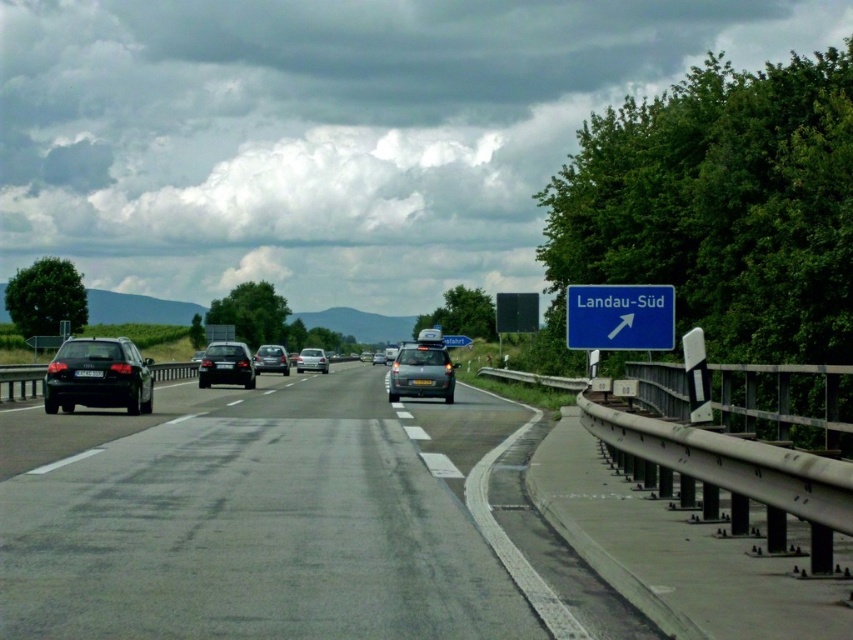
Looking at this image, who is more distant from viewer, (453, 364) or (270, 360)?

The point (453, 364) is more distant.

The image size is (853, 640). Find the location of `satin silver car at center`. satin silver car at center is located at coordinates (421, 372).

Can you confirm if shiny black sedan at left is wider than shiny metallic car at center?

In fact, shiny black sedan at left might be narrower than shiny metallic car at center.

Is point (45, 397) in front of point (277, 349)?

Yes, it is in front of point (277, 349).

This screenshot has width=853, height=640. Find the location of `shiny black sedan at left`. shiny black sedan at left is located at coordinates (97, 378).

Does shiny black sedan at center have a greater width compared to yellow matte license plate at center?

Correct, the width of shiny black sedan at center exceeds that of yellow matte license plate at center.

Between shiny black sedan at center and yellow matte license plate at center, which one has less height?

yellow matte license plate at center

Between point (202, 387) and point (428, 381), which one is positioned behind?

The point (202, 387) is behind.

Identify the location of shiny black sedan at center. (225, 364).